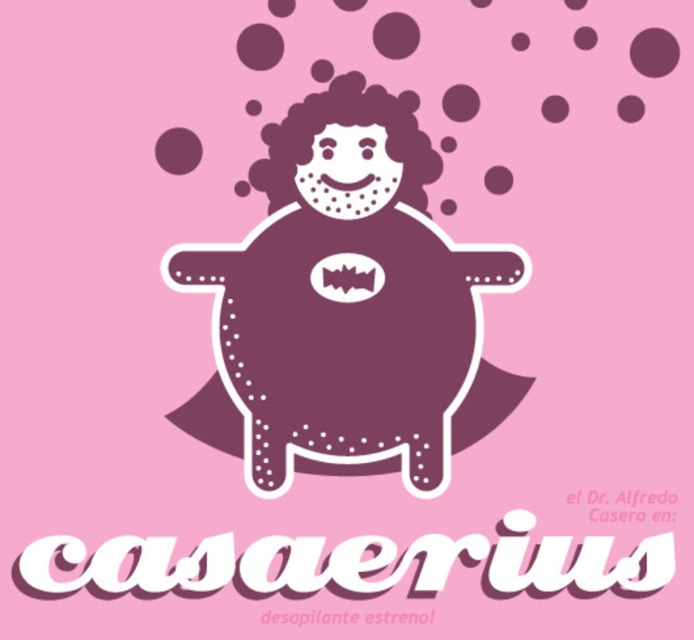
Question: Does purple dotted figure at center have a lesser width compared to matte purple circle at center?

Choices:
 (A) no
 (B) yes

Answer: (A)

Question: Is purple dotted figure at center below matte purple circle at center?

Choices:
 (A) yes
 (B) no

Answer: (A)

Question: Among these points, which one is nearest to the camera?

Choices:
 (A) pyautogui.click(x=347, y=236)
 (B) pyautogui.click(x=357, y=294)

Answer: (A)

Question: Which of the following is the closest to the observer?

Choices:
 (A) matte purple circle at center
 (B) purple dotted figure at center

Answer: (B)

Question: Is purple dotted figure at center closer to camera compared to matte purple circle at center?

Choices:
 (A) yes
 (B) no

Answer: (A)